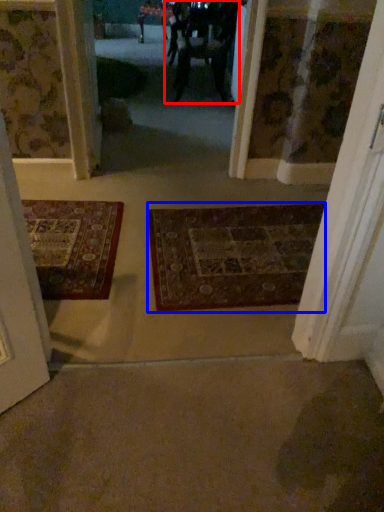
Question: Which point is further to the camera, couple (highlighted by a red box) or mat (highlighted by a blue box)?

Choices:
 (A) couple
 (B) mat

Answer: (A)